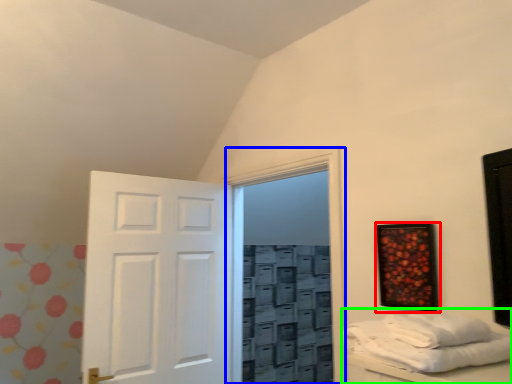
Question: Based on their relative distances, which object is farther from picture frame (highlighted by a red box)? Choose from glass door (highlighted by a blue box) and furniture (highlighted by a green box).

Choices:
 (A) glass door
 (B) furniture

Answer: (B)